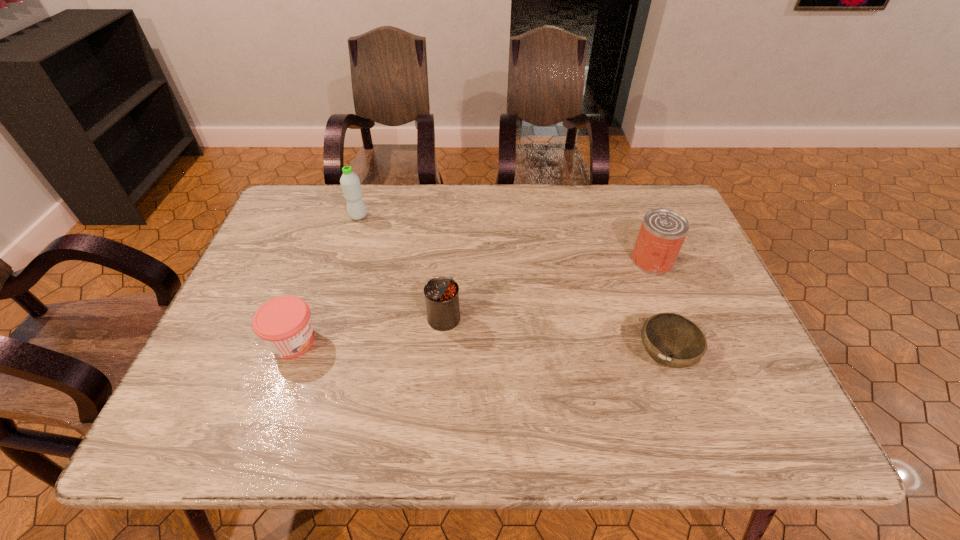
Locate an element on the screen. The image size is (960, 540). the tallest object is located at coordinates (349, 181).

The height and width of the screenshot is (540, 960). I want to click on the farthest object, so click(x=349, y=181).

Where is `the farther can`? This screenshot has height=540, width=960. the farther can is located at coordinates (663, 231).

Image resolution: width=960 pixels, height=540 pixels. Find the location of `the second farthest object`. the second farthest object is located at coordinates (663, 231).

This screenshot has width=960, height=540. Find the location of `the left can`. the left can is located at coordinates (441, 293).

You are a GUI agent. You are given a task and a screenshot of the screen. Output one action in this format:
    pyautogui.click(x=<x>, y=<y>)
    Task: Click on the third object from right to left
    
    Given the screenshot: What is the action you would take?
    pyautogui.click(x=441, y=293)

Identify the location of the fourth tallest object. (284, 324).

Identify the location of bowl. (672, 340).

Locate an element on the screen. This screenshot has width=960, height=540. free space located 0.100m on the front of the water bottle is located at coordinates (349, 245).

Where is `vacant space located 0.290m on the back of the farther can`? The image size is (960, 540). vacant space located 0.290m on the back of the farther can is located at coordinates (623, 187).